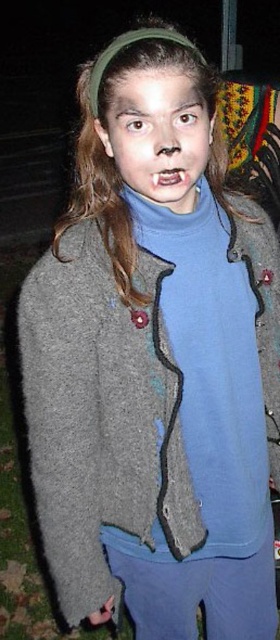
Who is shorter, matte skin face at center or teeth white glossy at center?

teeth white glossy at center

In the scene shown: Does matte skin face at center appear on the left side of teeth white glossy at center?

Yes, matte skin face at center is to the left of teeth white glossy at center.

The width and height of the screenshot is (280, 640). I want to click on matte skin face at center, so click(x=157, y=132).